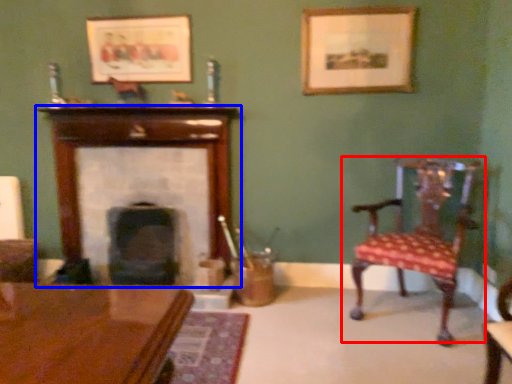
Question: Among these objects, which one is nearest to the camera, chair (highlighted by a red box) or fireplace (highlighted by a blue box)?

Choices:
 (A) chair
 (B) fireplace

Answer: (A)